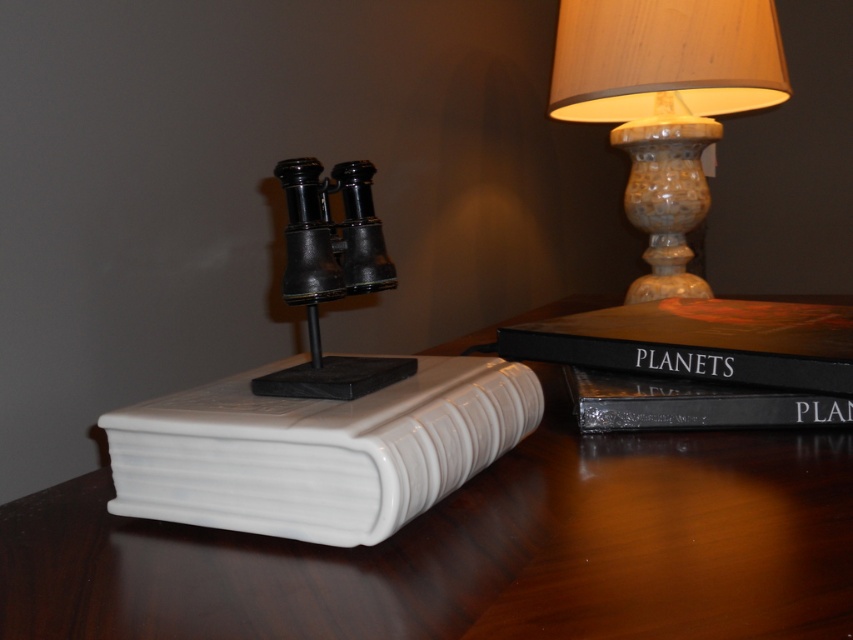
You are organizing a display on the table and need to place both the black matte book at upper right and the hardcover book at right. Since space is limited, which book should you place first to ensure both fit properly?

The black matte book at upper right is larger in size than the hardcover book at right, so you should place the black matte book at upper right first to accommodate its larger size before placing the smaller hardcover book at right.

You are a delivery person who needs to place a package that is 35 inches long on the table. The package must be placed between the matte beige lampshade at upper right and the hardcover book at right. Is there enough space between them to fit the package?

The distance between the matte beige lampshade at upper right and the hardcover book at right is 34.90 inches. Since the package is 35 inches long, it is slightly longer than the available space, so it won

You are organizing items on a table and need to place a new object between the black matte book at upper right and the hardcover book at right. Based on their positions, which book should you place the new object closer to?

The black matte book at upper right is in front of the hardcover book at right, so placing the new object closer to the black matte book at upper right would keep it in the foreground, while placing it closer to the hardcover book at right would position it further back. Choose based on desired placement.